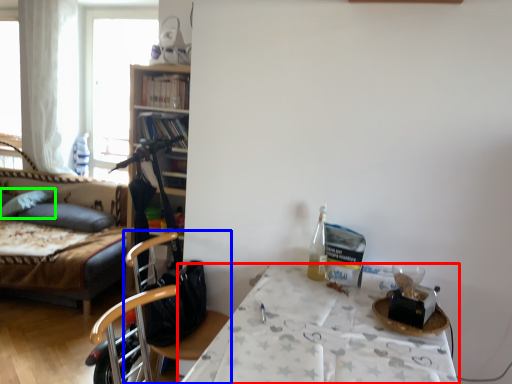
Question: Which is farther away from table (highlighted by a red box)? chair (highlighted by a blue box) or pillow (highlighted by a green box)?

Choices:
 (A) chair
 (B) pillow

Answer: (B)